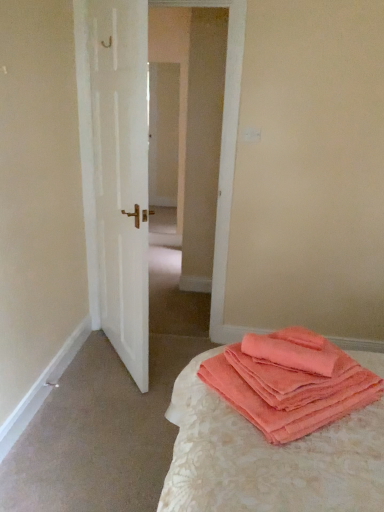
Question: From their relative heights in the image, would you say coral terry cloth towels at lower right is taller or shorter than coral fleece towels at lower right?

Choices:
 (A) tall
 (B) short

Answer: (A)

Question: Is coral terry cloth towels at lower right inside the boundaries of coral fleece towels at lower right, or outside?

Choices:
 (A) outside
 (B) inside

Answer: (A)

Question: Which of these objects is positioned farthest from the coral terry cloth towels at lower right?

Choices:
 (A) white matte door at left
 (B) coral fleece towels at lower right

Answer: (A)

Question: Which object is the farthest from the coral fleece towels at lower right?

Choices:
 (A) white matte door at left
 (B) coral terry cloth towels at lower right

Answer: (A)